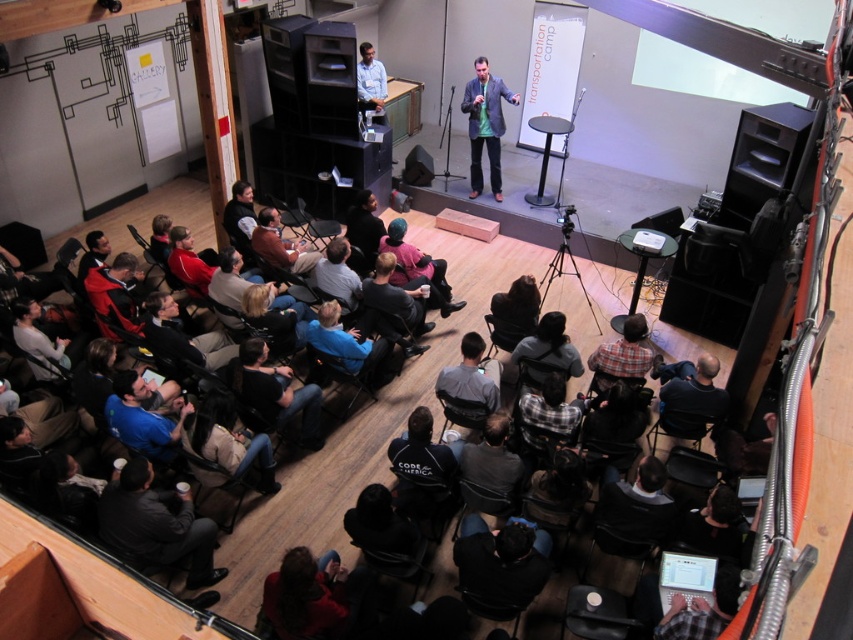
Which of these two, dark gray fabric jacket at center or light blue shirt at center, stands taller?

light blue shirt at center is taller.

Is dark gray fabric jacket at center taller than light blue shirt at center?

In fact, dark gray fabric jacket at center may be shorter than light blue shirt at center.

The height and width of the screenshot is (640, 853). Describe the element at coordinates (515, 307) in the screenshot. I see `dark gray fabric jacket at center` at that location.

Where is `dark gray fabric jacket at center`? The width and height of the screenshot is (853, 640). dark gray fabric jacket at center is located at coordinates [x=515, y=307].

Is dark red sweater at lower center taller than dark gray jacket at lower left?

No, dark red sweater at lower center is not taller than dark gray jacket at lower left.

Can you confirm if dark red sweater at lower center is bigger than dark gray jacket at lower left?

No, dark red sweater at lower center is not bigger than dark gray jacket at lower left.

You are a GUI agent. You are given a task and a screenshot of the screen. Output one action in this format:
    pyautogui.click(x=<x>, y=<y>)
    Task: Click on the dark red sweater at lower center
    The height and width of the screenshot is (640, 853).
    Given the screenshot: What is the action you would take?
    pyautogui.click(x=305, y=596)

Is dark gray leather jacket at lower left further to the viewer compared to blue fabric shirt at lower left?

No, dark gray leather jacket at lower left is in front of blue fabric shirt at lower left.

Between dark gray leather jacket at lower left and blue fabric shirt at lower left, which one has less height?

With less height is blue fabric shirt at lower left.

Find the location of a particular element. The image size is (853, 640). dark gray leather jacket at lower left is located at coordinates (155, 525).

Identify the location of dark gray leather jacket at lower left. This screenshot has width=853, height=640. (155, 525).